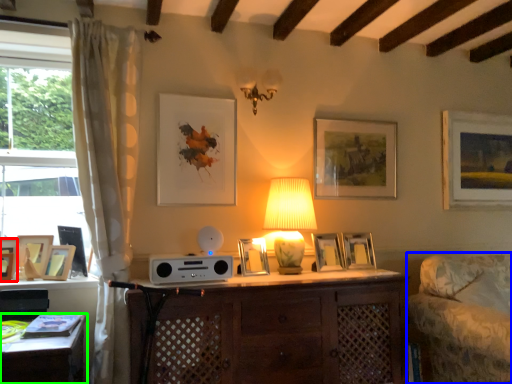
Question: Estimate the real-world distances between objects in this image. Which object is farther from picture frame (highlighted by a red box), swivel chair (highlighted by a blue box) or desk (highlighted by a green box)?

Choices:
 (A) swivel chair
 (B) desk

Answer: (A)